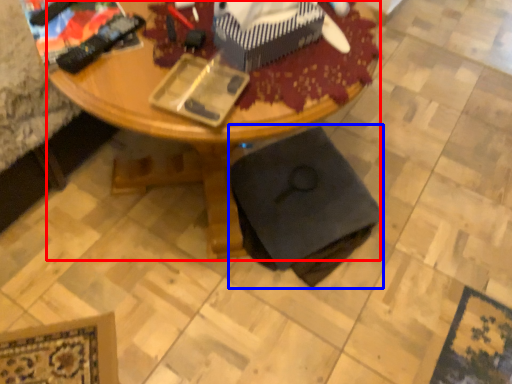
Question: Which object appears farthest to the camera in this image, desk (highlighted by a red box) or swivel chair (highlighted by a blue box)?

Choices:
 (A) desk
 (B) swivel chair

Answer: (B)